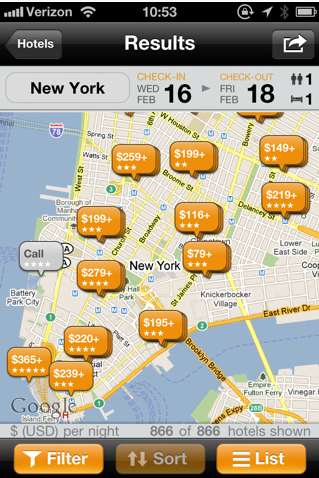
In order to click on bed icon in this screenshot , I will do `click(295, 99)`.